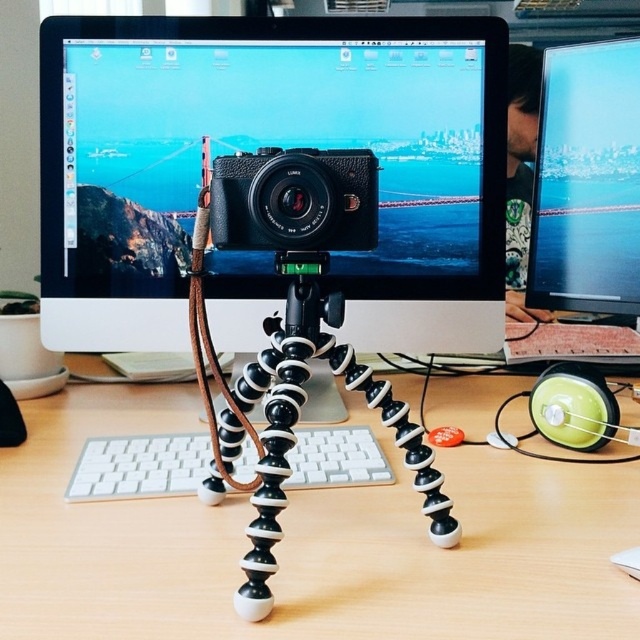
Which is more to the left, matte black monitor at upper right or black rubberized tripod at center?

black rubberized tripod at center

Is point (628, 67) positioned in front of point (326, 344)?

No, (628, 67) is further to viewer.

Is point (600, 212) behind point (285, 465)?

Yes, it is.

Where is `matte black monitor at upper right`? The image size is (640, 640). matte black monitor at upper right is located at coordinates (588, 180).

Is point (454, 230) farther from viewer compared to point (145, 538)?

Yes.

Identify the location of satin black monitor at center. The height and width of the screenshot is (640, 640). (266, 147).

Does black rubberized tripod at center have a lesser width compared to leather textured camera at center?

No.

The image size is (640, 640). In order to click on black rubberized tripod at center in this screenshot , I will do `click(298, 416)`.

Identify the location of black rubberized tripod at center. Image resolution: width=640 pixels, height=640 pixels. (298, 416).